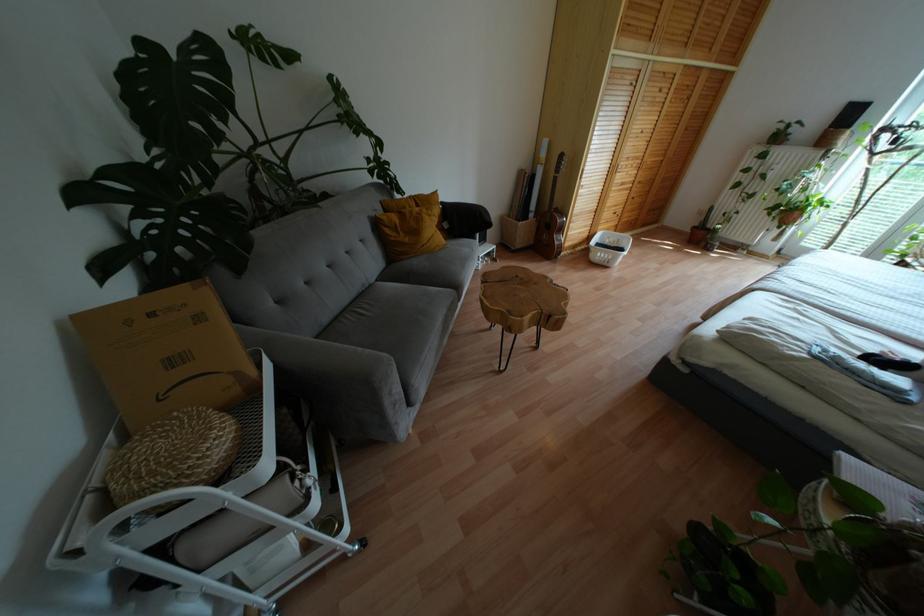
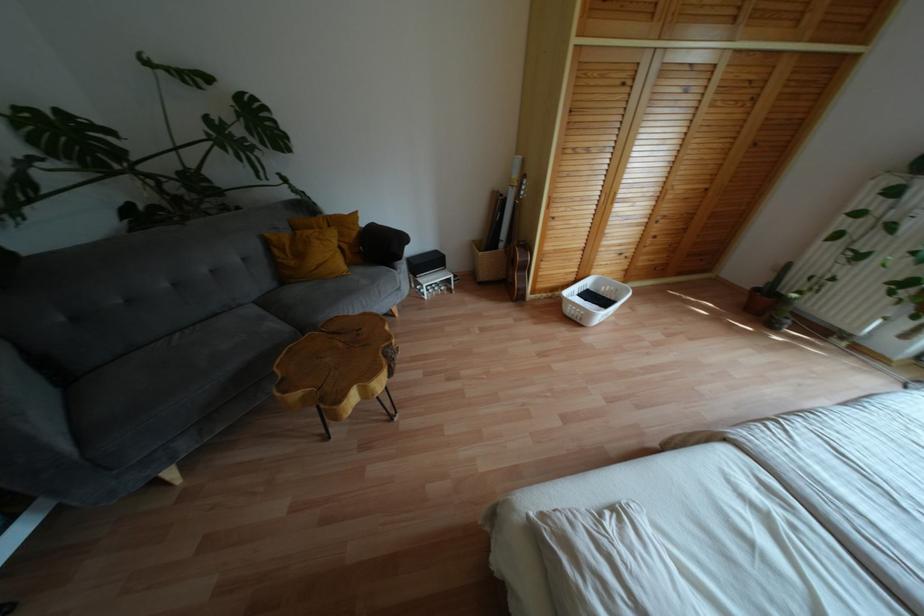
The images are taken continuously from a first-person perspective. In which direction are you moving?

The cameraman moved toward right, forward.